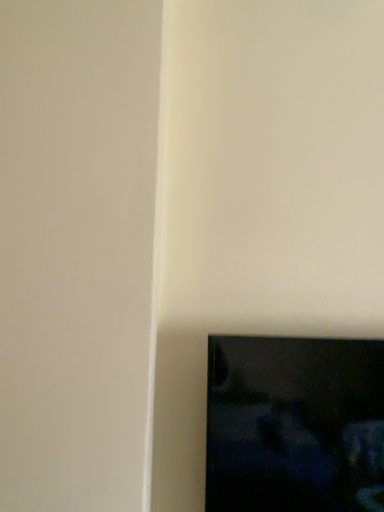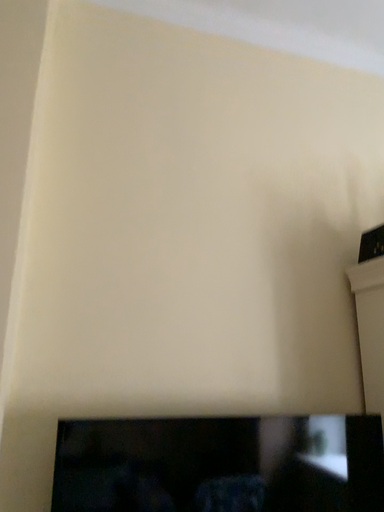
Question: How did the camera likely rotate when shooting the video?

Choices:
 (A) rotated left
 (B) rotated right

Answer: (B)